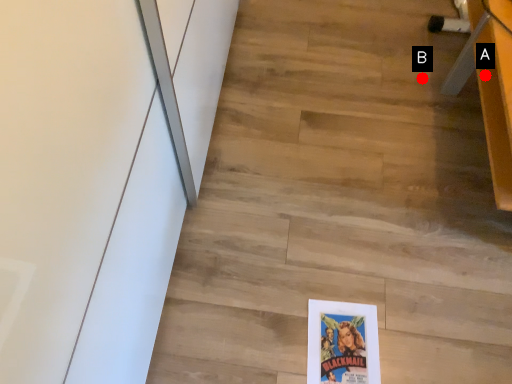
Question: Two points are circled on the image, labeled by A and B beside each circle. Which point appears farthest from the camera in this image?

Choices:
 (A) A is further
 (B) B is further

Answer: (B)